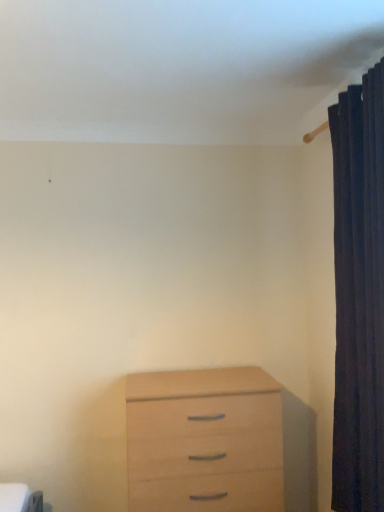
This screenshot has width=384, height=512. What do you see at coordinates (204, 440) in the screenshot? I see `light wood chest of drawers at lower center` at bounding box center [204, 440].

Measure the distance between point (133, 478) and camera.

Point (133, 478) is 2.03 meters from camera.

At what (x,y) coordinates should I click in order to perform the action: click on light wood chest of drawers at lower center. Please return your answer as a coordinate pair (x, y). Looking at the image, I should click on (204, 440).

What do you see at coordinates (359, 295) in the screenshot? This screenshot has width=384, height=512. I see `dark fabric curtain at right` at bounding box center [359, 295].

Where is `dark fabric curtain at right`? The image size is (384, 512). dark fabric curtain at right is located at coordinates (359, 295).

Where is `light wood chest of drawers at lower center`? This screenshot has height=512, width=384. light wood chest of drawers at lower center is located at coordinates (204, 440).

Based on their positions, is light wood chest of drawers at lower center located to the left or right of dark fabric curtain at right?

In the image, light wood chest of drawers at lower center appears on the left side of dark fabric curtain at right.

Based on the photo, is light wood chest of drawers at lower center further to the viewer compared to dark fabric curtain at right?

Yes, it is.

Considering the points (182, 459) and (333, 457), which point is in front, point (182, 459) or point (333, 457)?

Positioned in front is point (333, 457).

From the image's perspective, is light wood chest of drawers at lower center above or below dark fabric curtain at right?

light wood chest of drawers at lower center is situated lower than dark fabric curtain at right in the image.

From a real-world perspective, is light wood chest of drawers at lower center located beneath dark fabric curtain at right?

Yes, from a real-world perspective, light wood chest of drawers at lower center is beneath dark fabric curtain at right.

Based on the photo, considering the relative sizes of light wood chest of drawers at lower center and dark fabric curtain at right in the image provided, is light wood chest of drawers at lower center wider than dark fabric curtain at right?

Yes.

Considering the sizes of objects light wood chest of drawers at lower center and dark fabric curtain at right in the image provided, who is taller, light wood chest of drawers at lower center or dark fabric curtain at right?

dark fabric curtain at right is taller.

Looking at the image, does light wood chest of drawers at lower center seem bigger or smaller compared to dark fabric curtain at right?

In the image, light wood chest of drawers at lower center appears to be larger than dark fabric curtain at right.

Is light wood chest of drawers at lower center not inside dark fabric curtain at right?

Absolutely, light wood chest of drawers at lower center is external to dark fabric curtain at right.

Are light wood chest of drawers at lower center and dark fabric curtain at right located far from each other?

No, light wood chest of drawers at lower center is not far away from dark fabric curtain at right.

Is light wood chest of drawers at lower center oriented towards dark fabric curtain at right?

No, light wood chest of drawers at lower center is not facing towards dark fabric curtain at right.

How many degrees apart are the facing directions of light wood chest of drawers at lower center and dark fabric curtain at right?

light wood chest of drawers at lower center and dark fabric curtain at right are facing 89.5 degrees away from each other.

Where is `curtain located in front of the light wood chest of drawers at lower center`? curtain located in front of the light wood chest of drawers at lower center is located at coordinates (359, 295).

Can you confirm if dark fabric curtain at right is positioned to the right of light wood chest of drawers at lower center?

Indeed, dark fabric curtain at right is positioned on the right side of light wood chest of drawers at lower center.

Who is more distant, dark fabric curtain at right or light wood chest of drawers at lower center?

light wood chest of drawers at lower center is more distant.

Between point (337, 385) and point (276, 494), which one is positioned behind?

Positioned behind is point (276, 494).

From the image's perspective, which object appears higher, dark fabric curtain at right or light wood chest of drawers at lower center?

dark fabric curtain at right, from the image's perspective.

From a real-world perspective, relative to light wood chest of drawers at lower center, is dark fabric curtain at right vertically above or below?

dark fabric curtain at right is above light wood chest of drawers at lower center.

In terms of width, does dark fabric curtain at right look wider or thinner when compared to light wood chest of drawers at lower center?

Clearly, dark fabric curtain at right has less width compared to light wood chest of drawers at lower center.

Who is shorter, dark fabric curtain at right or light wood chest of drawers at lower center?

light wood chest of drawers at lower center.

Who is bigger, dark fabric curtain at right or light wood chest of drawers at lower center?

Bigger between the two is light wood chest of drawers at lower center.

Is light wood chest of drawers at lower center surrounded by dark fabric curtain at right?

No, light wood chest of drawers at lower center is not a part of dark fabric curtain at right.

Is dark fabric curtain at right positioned far away from light wood chest of drawers at lower center?

Actually, dark fabric curtain at right and light wood chest of drawers at lower center are a little close together.

Is dark fabric curtain at right facing away from light wood chest of drawers at lower center?

dark fabric curtain at right is not turned away from light wood chest of drawers at lower center.

Can you tell me how much dark fabric curtain at right and light wood chest of drawers at lower center differ in facing direction?

The facing directions of dark fabric curtain at right and light wood chest of drawers at lower center are 89.5 degrees apart.

Locate an element on the screen. curtain in front of the light wood chest of drawers at lower center is located at coordinates (359, 295).

Image resolution: width=384 pixels, height=512 pixels. I want to click on chest of drawers on the left of dark fabric curtain at right, so click(x=204, y=440).

Image resolution: width=384 pixels, height=512 pixels. I want to click on curtain in front of the light wood chest of drawers at lower center, so click(x=359, y=295).